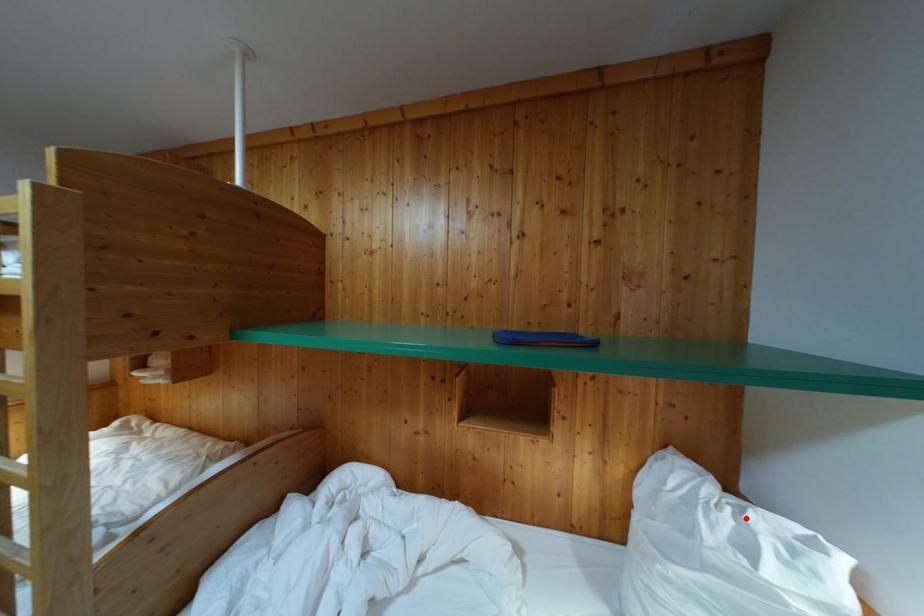
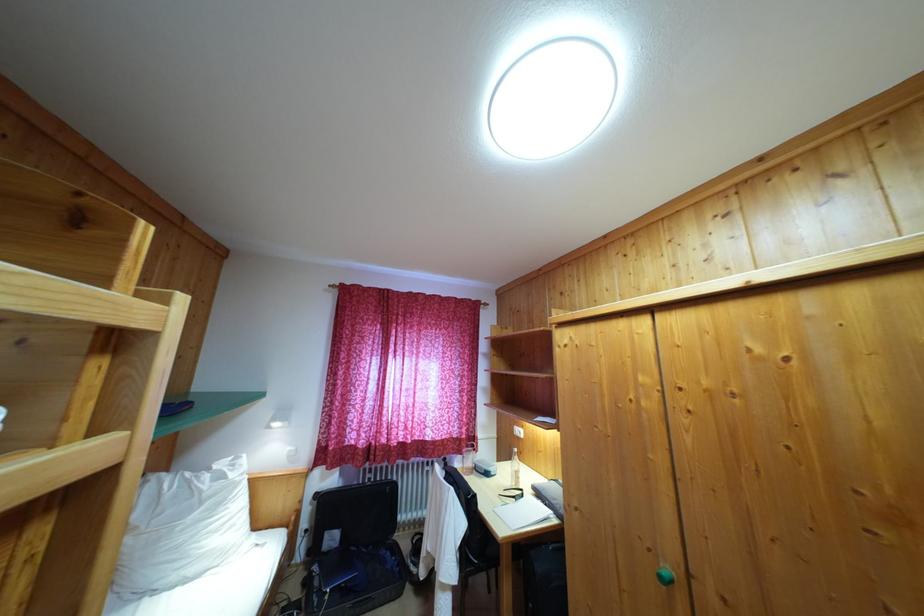
The point at the highlighted location is marked in the first image. Where is the corresponding point in the second image?

(213, 476)